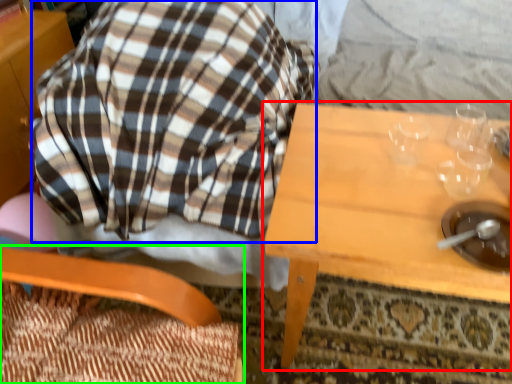
Question: Considering the real-world distances, which object is farthest from table (highlighted by a red box)? flannel (highlighted by a blue box) or chair (highlighted by a green box)?

Choices:
 (A) flannel
 (B) chair

Answer: (B)